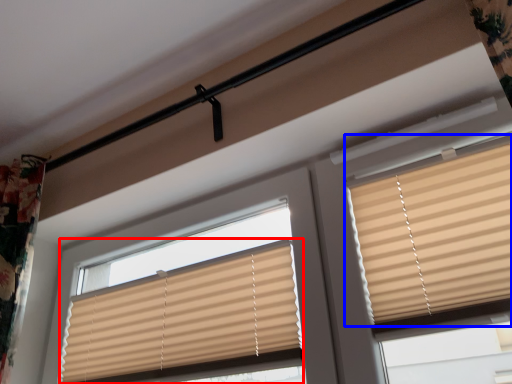
Question: Among these objects, which one is nearest to the camera, window blind (highlighted by a red box) or window blind (highlighted by a blue box)?

Choices:
 (A) window blind
 (B) window blind

Answer: (B)